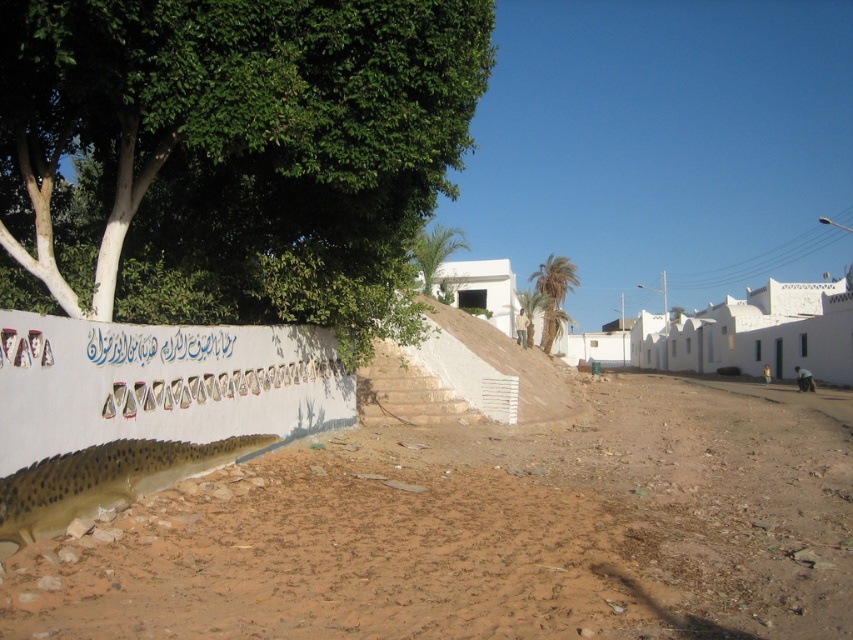
You are standing at the point marked as point (482, 532) in the image. What is the terrain like at your current location?

The terrain at point (482, 532) is brown sandy dirt at lower center.

Looking at this image, you are standing on the brown sandy dirt at lower center and want to walk to the green leafy palm at center. Which direction should you move to get closer to the palm?

Since the brown sandy dirt at lower center is closer to the viewer than the green leafy palm at center, you should move forward towards the palm to get closer.